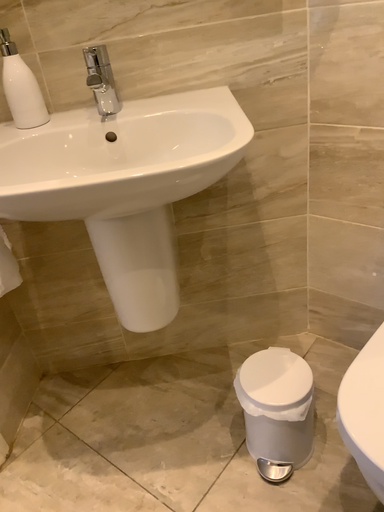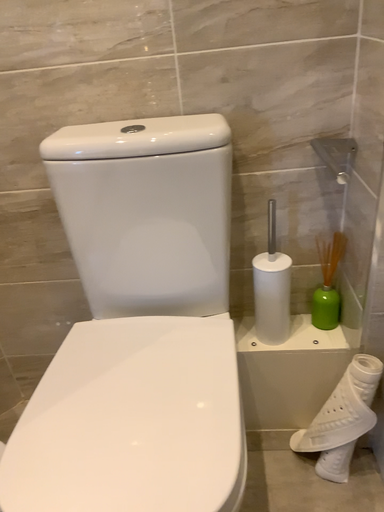
Question: How did the camera likely rotate when shooting the video?

Choices:
 (A) rotated left
 (B) rotated right

Answer: (B)